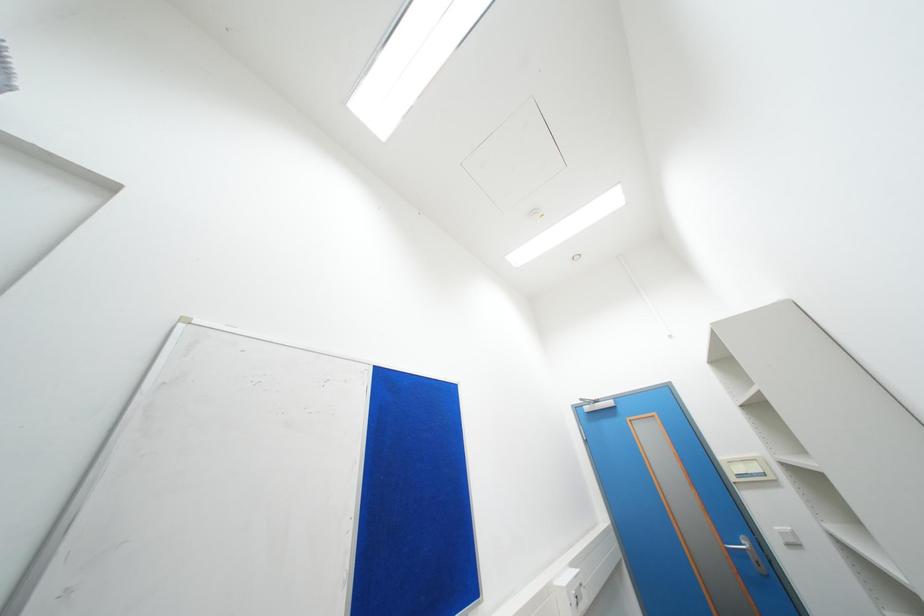
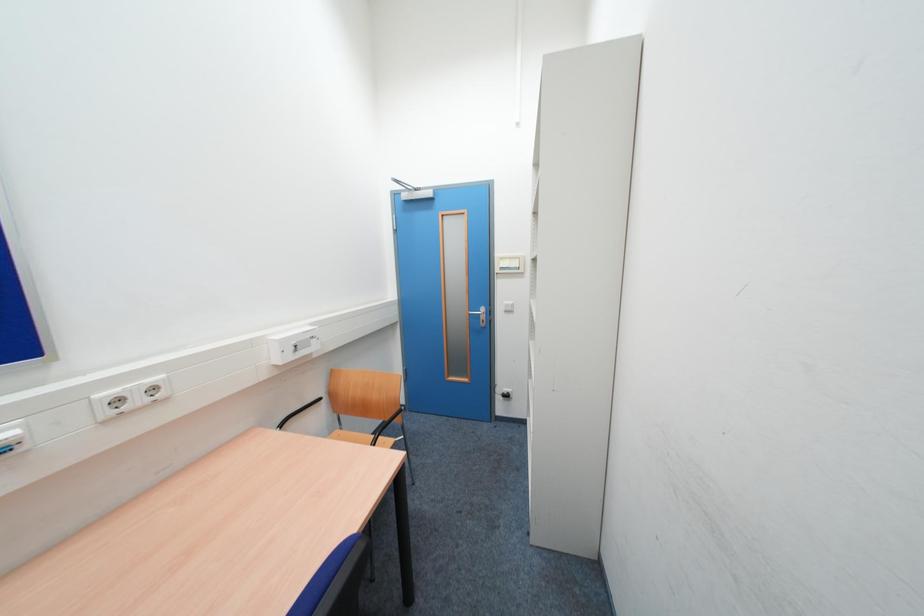
Based on the continuous images, in which direction is the camera rotating?

The camera rotated toward right-down.